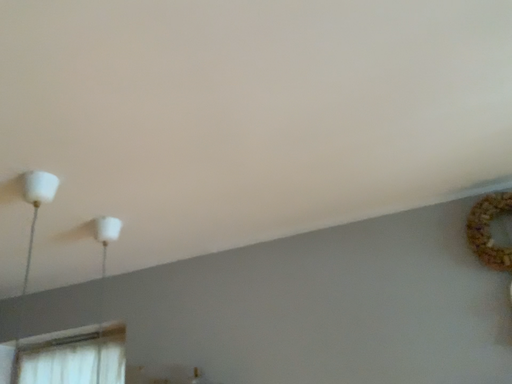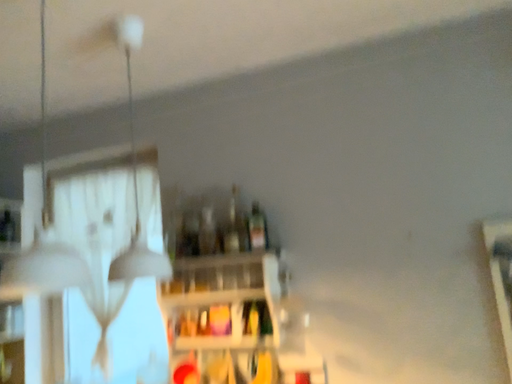
Question: Which way did the camera rotate in the video?

Choices:
 (A) rotated downward
 (B) rotated upward

Answer: (A)